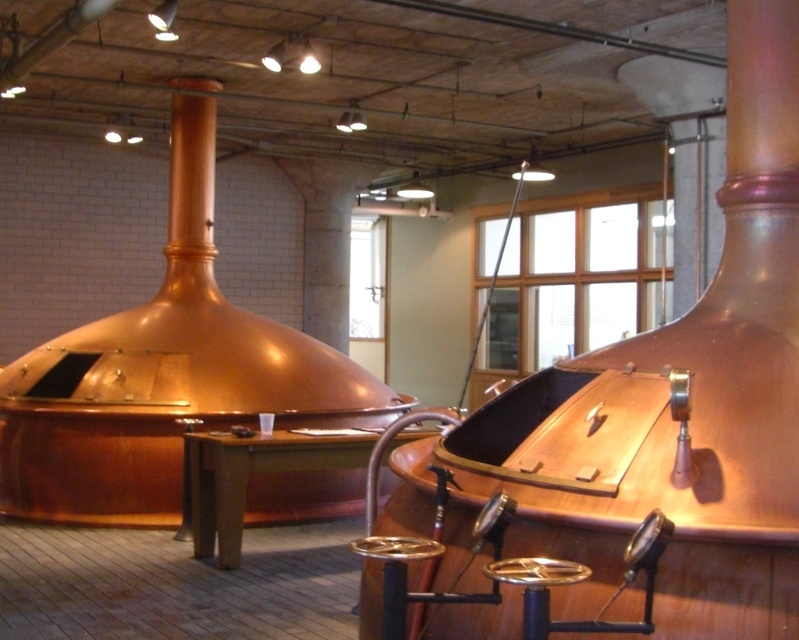
From the picture: Can you confirm if metallic stool at center is thinner than shiny metallic stool at center?

Correct, metallic stool at center's width is less than shiny metallic stool at center's.

Can you confirm if metallic stool at center is wider than shiny metallic stool at center?

No.

The image size is (799, 640). Find the location of `metallic stool at center`. metallic stool at center is located at coordinates (396, 573).